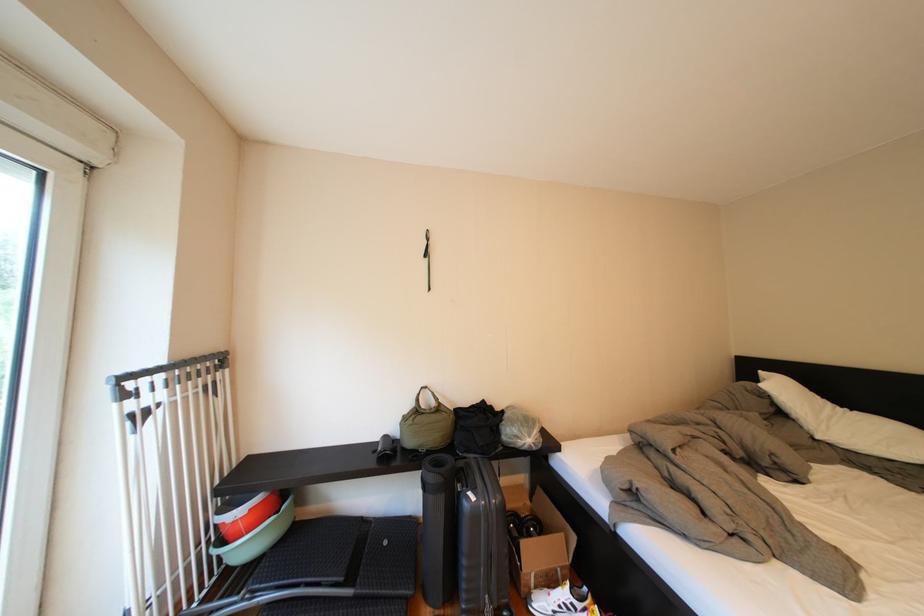
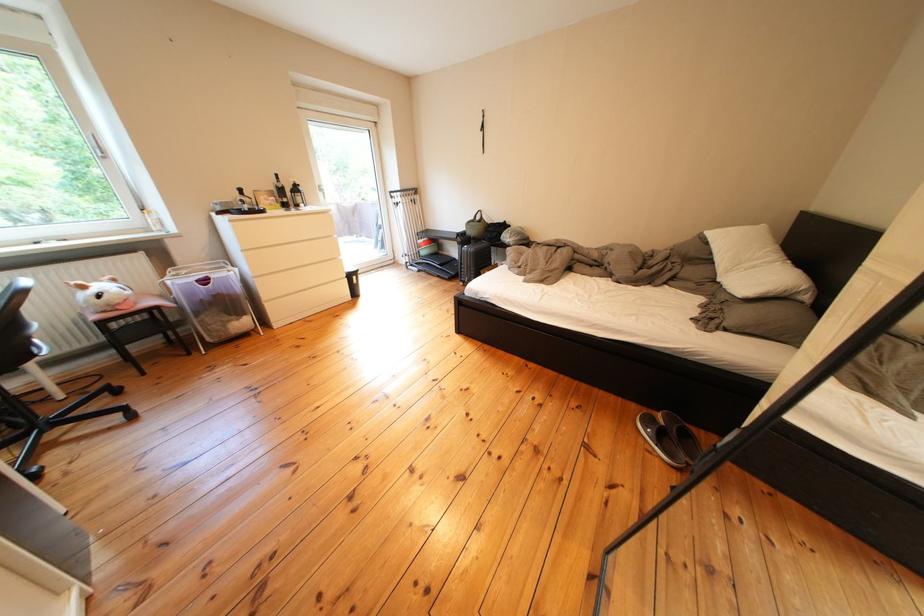
Find the pixel in the second image that matches (x=487, y=503) in the first image.

(479, 252)